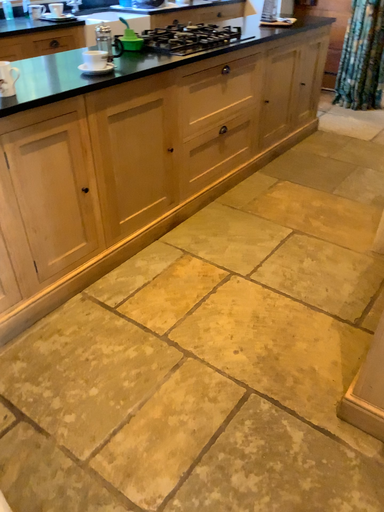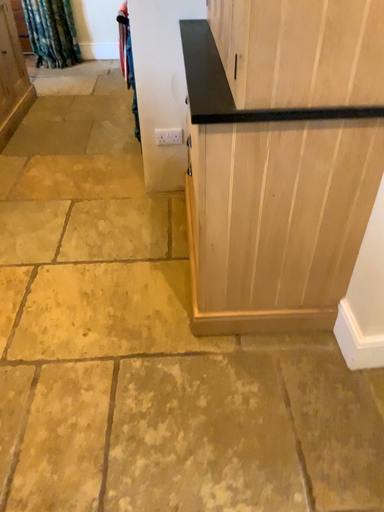
Question: How did the camera likely rotate when shooting the video?

Choices:
 (A) rotated left
 (B) rotated right

Answer: (B)